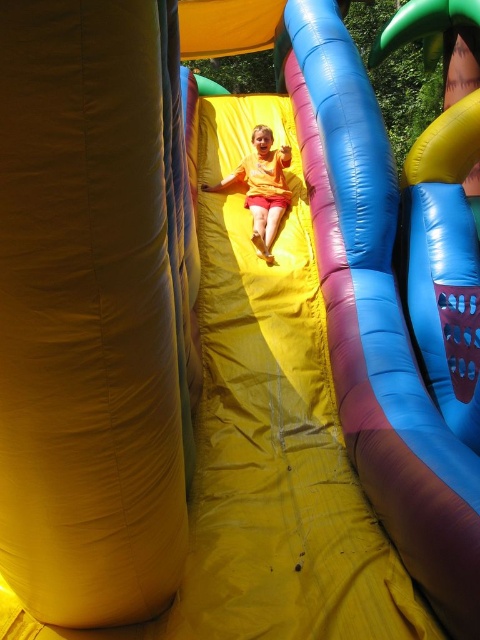
Does yellow fabric slide at center appear under yellow matte shorts at center?

Yes.

Does yellow fabric slide at center have a lesser width compared to yellow matte shorts at center?

Correct, yellow fabric slide at center's width is less than yellow matte shorts at center's.

Is point (336, 216) less distant than point (254, 234)?

Yes, it is in front of point (254, 234).

In order to click on yellow fabric slide at center in this screenshot , I will do `click(370, 376)`.